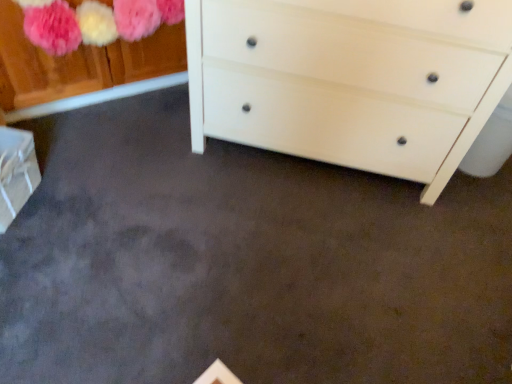
Question: From the image's perspective, does white cardboard box at lower left appear lower than white matte chest of drawers at center?

Choices:
 (A) no
 (B) yes

Answer: (B)

Question: Does white cardboard box at lower left appear on the left side of white matte chest of drawers at center?

Choices:
 (A) no
 (B) yes

Answer: (B)

Question: Does white cardboard box at lower left come in front of white matte chest of drawers at center?

Choices:
 (A) no
 (B) yes

Answer: (A)

Question: Is white cardboard box at lower left taller than white matte chest of drawers at center?

Choices:
 (A) no
 (B) yes

Answer: (A)

Question: Considering the relative sizes of white cardboard box at lower left and white matte chest of drawers at center in the image provided, is white cardboard box at lower left bigger than white matte chest of drawers at center?

Choices:
 (A) yes
 (B) no

Answer: (B)

Question: From a real-world perspective, is white cardboard box at lower left located higher than white matte chest of drawers at center?

Choices:
 (A) yes
 (B) no

Answer: (B)

Question: From the image's perspective, is white matte chest of drawers at center located above white cardboard box at lower left?

Choices:
 (A) yes
 (B) no

Answer: (A)

Question: From a real-world perspective, is white matte chest of drawers at center physically above white cardboard box at lower left?

Choices:
 (A) yes
 (B) no

Answer: (A)

Question: Is white matte chest of drawers at center outside white cardboard box at lower left?

Choices:
 (A) yes
 (B) no

Answer: (A)

Question: Could you tell me if white matte chest of drawers at center is turned towards white cardboard box at lower left?

Choices:
 (A) no
 (B) yes

Answer: (A)

Question: Is white matte chest of drawers at center not close to white cardboard box at lower left?

Choices:
 (A) no
 (B) yes

Answer: (A)

Question: From a real-world perspective, is white matte chest of drawers at center beneath white cardboard box at lower left?

Choices:
 (A) no
 (B) yes

Answer: (A)

Question: Is white matte chest of drawers at center wider or thinner than white cardboard box at lower left?

Choices:
 (A) thin
 (B) wide

Answer: (B)